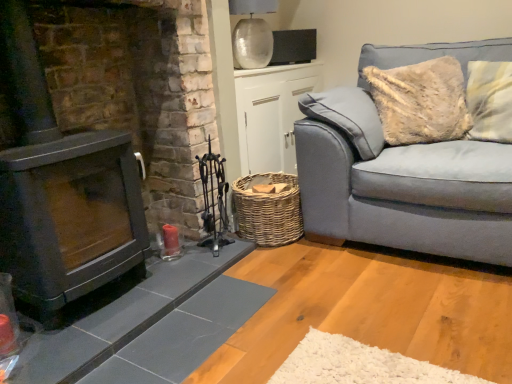
Question: From their relative heights in the image, would you say woven brown basket at lower center is taller or shorter than woven wicker basket at center?

Choices:
 (A) tall
 (B) short

Answer: (B)

Question: In the image, is woven brown basket at lower center on the left side or the right side of woven wicker basket at center?

Choices:
 (A) right
 (B) left

Answer: (A)

Question: Estimate the real-world distances between objects in this image. Which object is closer to the light blue fabric couch at right?

Choices:
 (A) woven brown basket at lower center
 (B) woven wicker basket at center
 (C) matte black fireplace at left

Answer: (A)

Question: Which of these objects is positioned closest to the woven brown basket at lower center?

Choices:
 (A) woven wicker basket at center
 (B) matte black fireplace at left
 (C) light blue fabric couch at right

Answer: (C)